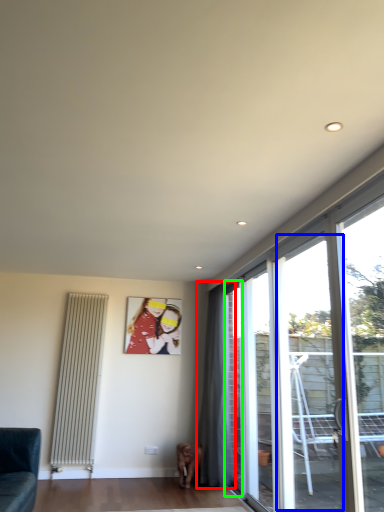
Question: Which object is positioned farthest from curtain (highlighted by a red box)? Select from window (highlighted by a blue box) and window (highlighted by a green box).

Choices:
 (A) window
 (B) window

Answer: (A)